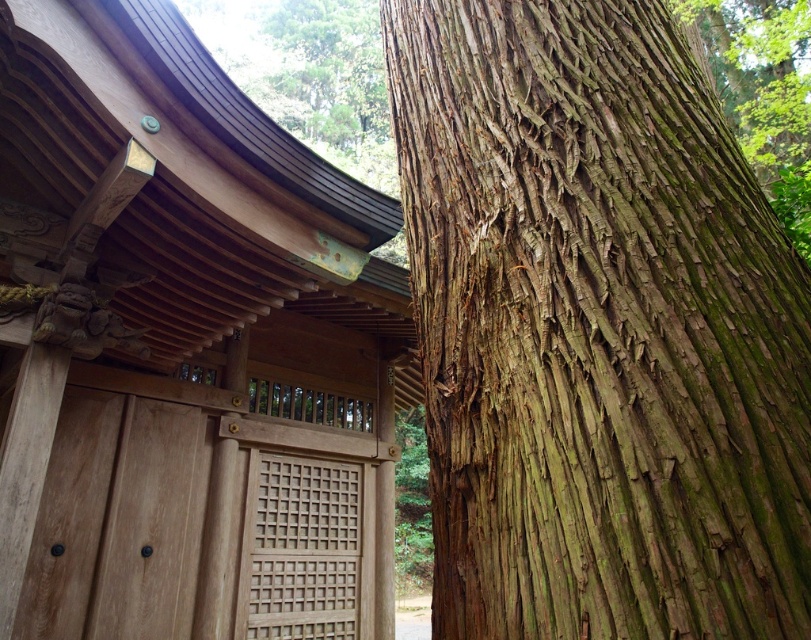
Is wooden at left positioned behind wooden lattice door at center?

No, it is not.

This screenshot has height=640, width=811. Describe the element at coordinates (185, 348) in the screenshot. I see `wooden at left` at that location.

You are a GUI agent. You are given a task and a screenshot of the screen. Output one action in this format:
    pyautogui.click(x=<x>, y=<y>)
    Task: Click on the wooden at left
    
    Given the screenshot: What is the action you would take?
    pos(185,348)

Where is `wooden at left`? wooden at left is located at coordinates (185, 348).

Measure the distance from wooden lattice door at center to green rough bark tree at upper center.

wooden lattice door at center is 12.08 meters from green rough bark tree at upper center.

Can you confirm if wooden lattice door at center is positioned above green rough bark tree at upper center?

Actually, wooden lattice door at center is below green rough bark tree at upper center.

Image resolution: width=811 pixels, height=640 pixels. What do you see at coordinates (299, 548) in the screenshot? I see `wooden lattice door at center` at bounding box center [299, 548].

Where is `wooden lattice door at center`? Image resolution: width=811 pixels, height=640 pixels. wooden lattice door at center is located at coordinates (299, 548).

Can you confirm if greenish-brown bark tree trunk at right is thinner than wooden lattice door at center?

In fact, greenish-brown bark tree trunk at right might be wider than wooden lattice door at center.

At what (x,y) coordinates should I click in order to perform the action: click on greenish-brown bark tree trunk at right. Please return your answer as a coordinate pair (x, y). Image resolution: width=811 pixels, height=640 pixels. Looking at the image, I should click on (597, 330).